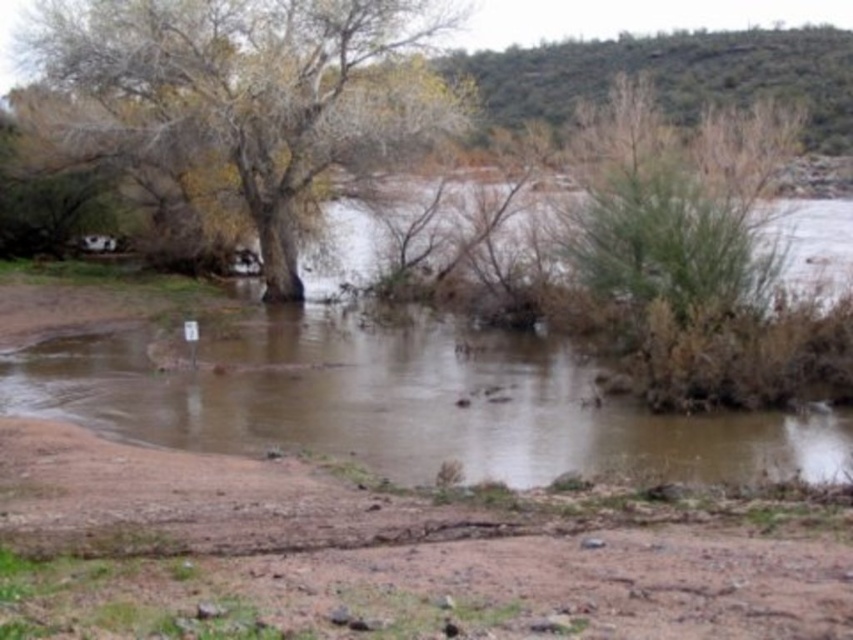
Question: Is brown muddy water at center further to the viewer compared to brown rough tree at upper left?

Choices:
 (A) no
 (B) yes

Answer: (A)

Question: Which object is farther from the camera taking this photo?

Choices:
 (A) brown rough tree at upper left
 (B) green leafy bush at upper right
 (C) brown muddy water at center

Answer: (A)

Question: Which object appears farthest from the camera in this image?

Choices:
 (A) green leafy bush at upper right
 (B) brown muddy water at center

Answer: (A)

Question: Does brown rough tree at upper left appear under green leafy bush at upper right?

Choices:
 (A) yes
 (B) no

Answer: (A)

Question: Which is nearer to the green leafy bush at upper right?

Choices:
 (A) brown muddy water at center
 (B) brown rough tree at upper left

Answer: (A)

Question: From the image, what is the correct spatial relationship of brown rough tree at upper left in relation to green leafy bush at upper right?

Choices:
 (A) above
 (B) below

Answer: (B)